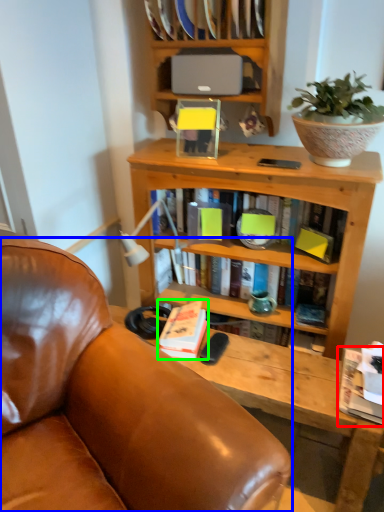
Question: Which object is positioned farthest from book (highlighted by a red box)? Select from chair (highlighted by a blue box) and book (highlighted by a green box).

Choices:
 (A) chair
 (B) book

Answer: (A)